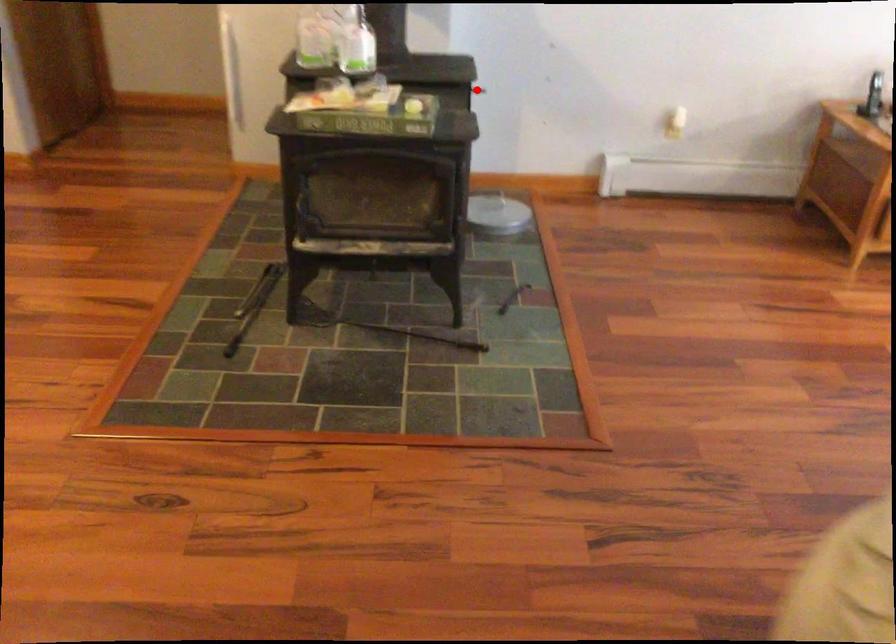
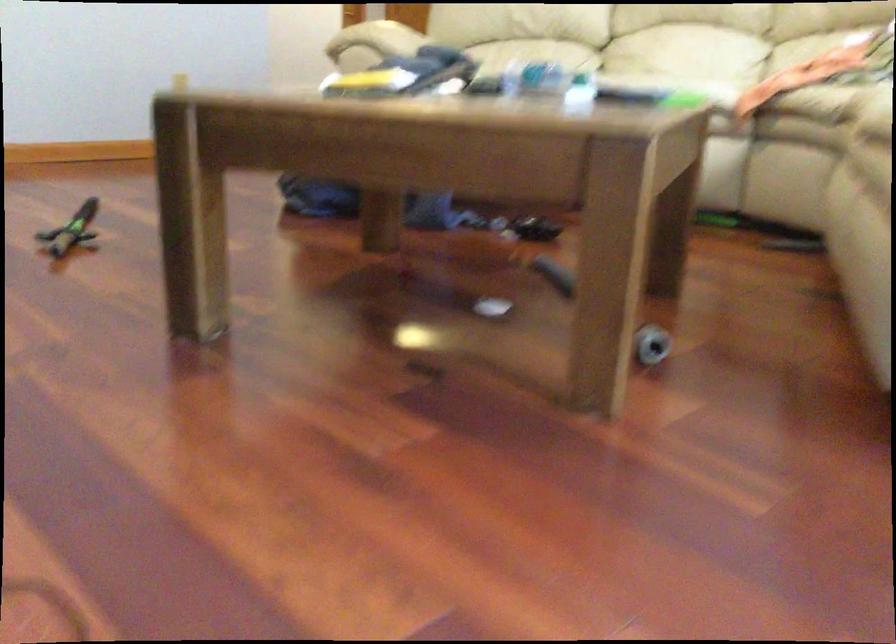
Question: I am providing you with two images of the same scene from different viewpoints. A red point is marked on the first image. Is the red point's position out of view in image 2?

Choices:
 (A) Yes
 (B) No

Answer: (A)